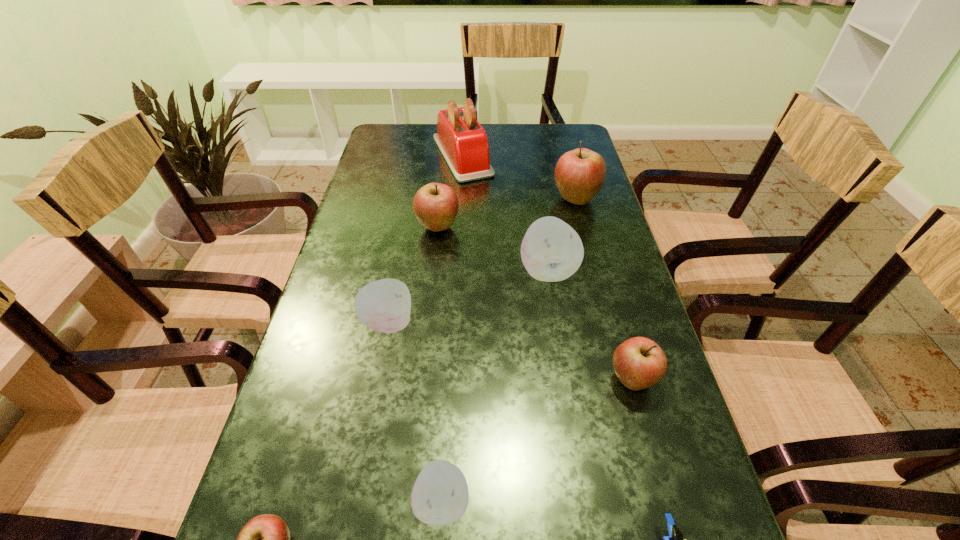
What are the coordinates of `apple identified as the sixth closest to the biggest red apple` in the screenshot? It's located at (265, 539).

Where is `red apple that stands as the third closest to the leftmost apple`? The height and width of the screenshot is (540, 960). red apple that stands as the third closest to the leftmost apple is located at coordinates (579, 174).

Find the location of a particular element. The height and width of the screenshot is (540, 960). red apple that stands as the closest to the tallest apple is located at coordinates (435, 205).

The width and height of the screenshot is (960, 540). Find the location of `white apple that is the closest one to the toaster`. white apple that is the closest one to the toaster is located at coordinates (551, 250).

Locate which white apple is the closest to the nearest white apple. Please provide its 2D coordinates. Your answer should be formatted as a tuple, i.e. [(x, y)], where the tuple contains the x and y coordinates of a point satisfying the conditions above.

[(384, 305)]

Identify the location of free space that satisfies the following two spatial constraints: 1. on the front side of the second biggest red apple; 2. on the left side of the nearest white apple. (408, 502).

Locate an element on the screen. vacant space that satisfies the following two spatial constraints: 1. on the back side of the second white apple from left to right; 2. on the left side of the second nearest red apple is located at coordinates coord(449,380).

Where is `vacant space that satisfies the following two spatial constraints: 1. on the front side of the biggest white apple; 2. on the left side of the toaster`? This screenshot has height=540, width=960. vacant space that satisfies the following two spatial constraints: 1. on the front side of the biggest white apple; 2. on the left side of the toaster is located at coordinates (456, 271).

Find the location of a particular element. free space that satisfies the following two spatial constraints: 1. on the back side of the farthest white apple; 2. on the left side of the second white apple from right to left is located at coordinates (455, 271).

Image resolution: width=960 pixels, height=540 pixels. In order to click on free location that satisfies the following two spatial constraints: 1. on the back side of the red toaster; 2. on the right side of the second biggest white apple in this screenshot , I will do `click(420, 156)`.